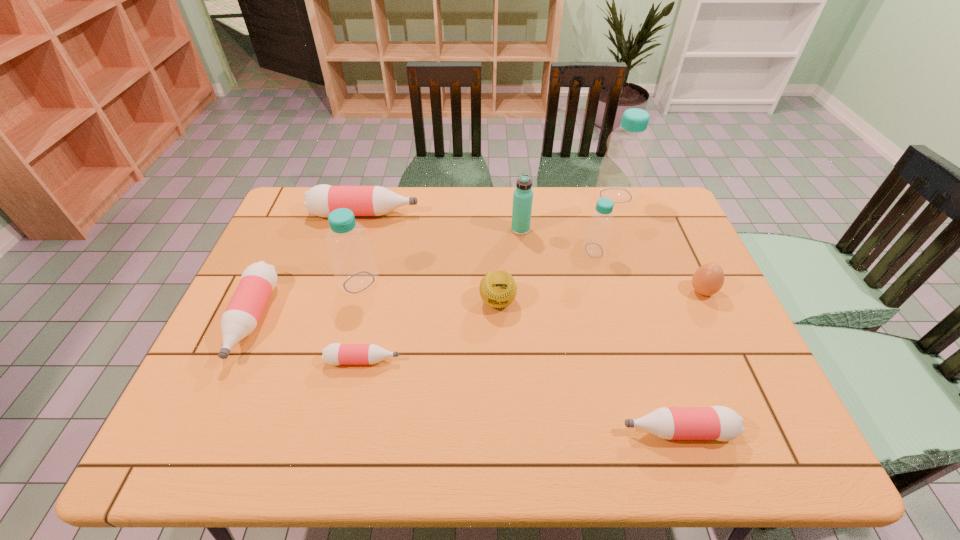
This screenshot has height=540, width=960. Identify the location of boiled egg. (708, 279).

At what (x,y) coordinates should I click in order to perform the action: click on the rightmost object. Please return your answer as a coordinate pair (x, y). Looking at the image, I should click on (708, 279).

Locate an element on the screen. yellow softball is located at coordinates (498, 289).

I want to click on the fifth object from left to right, so click(x=498, y=289).

Find the location of a particular element. the fifth tallest bottle is located at coordinates (258, 280).

Find the location of a particular element. This screenshot has width=960, height=540. the nearest object is located at coordinates (721, 423).

Identify the location of the rightmost pink bottle. The width and height of the screenshot is (960, 540). (721, 423).

This screenshot has width=960, height=540. Find the location of `the smallest pink bottle`. the smallest pink bottle is located at coordinates (334, 354).

The image size is (960, 540). Identify the location of the shortest object. (334, 354).

Locate an element on the screen. This screenshot has width=960, height=540. free space located 0.050m on the left of the biggest blue bottle is located at coordinates click(x=581, y=195).